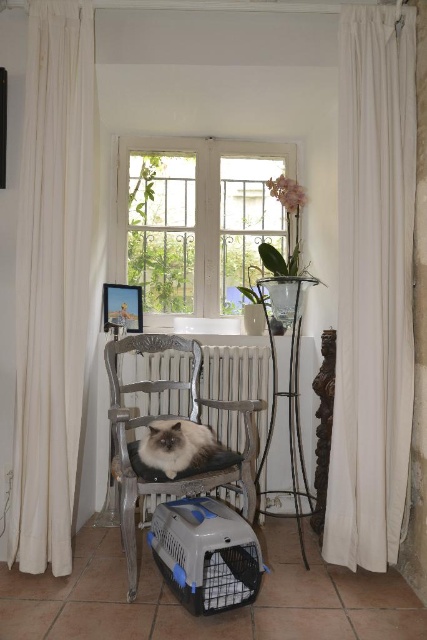
You are a delivery person standing at the entrance of the room. You need to hand over a package to someone through the white glass window at center. The package is 1.2 meters long. Can you pass the package through the window without bending down?

The white glass window at center is 3.23 meters away from camera. Since the package is 1.2 meters long, you can easily pass it through the window without bending down as the distance is sufficient.

You are standing in the room and want to open the window to let more air in. Which curtain should you move first, the white sheer curtain at right or the white sheer curtain at left?

You should move the white sheer curtain at right first because it is closer to you than the white sheer curtain at left, which is further away.

You are a delivery person who needs to place a small package on the tallest object in the room. Which object should you choose between the white sheer curtain at left and the gray plastic pet carrier at lower center?

The white sheer curtain at left is taller than the gray plastic pet carrier at lower center, so you should place the package on the white sheer curtain at left.